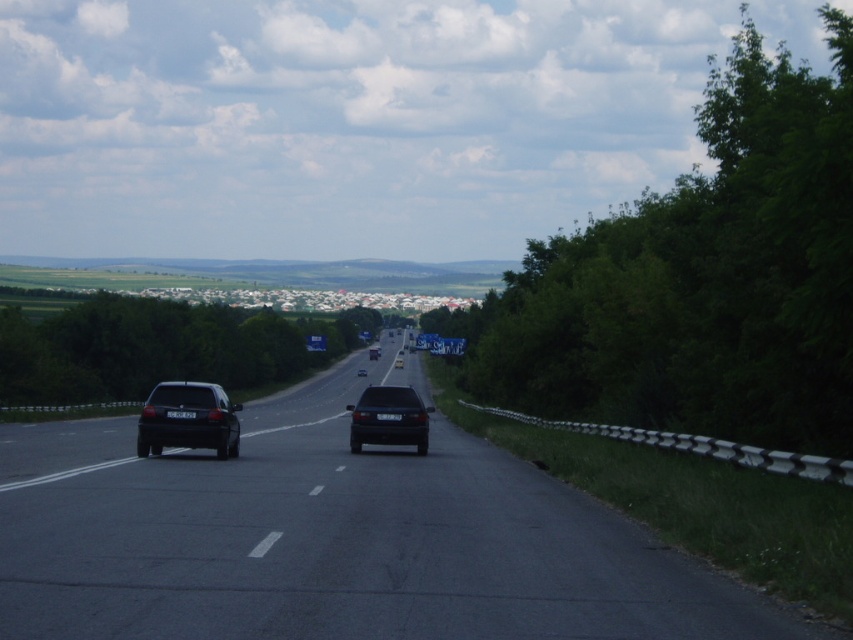
From the picture: You are a photographer planning to capture both the satin black sedan at left and the satin black sedan at center in your shot. Given that your camera frame can only accommodate objects up to 2 meters in width, which sedan should you focus on to ensure it fits within the frame?

The satin black sedan at left is thinner than the satin black sedan at center, so focusing on the satin black sedan at left would ensure it fits within the 2 meter width constraint of the camera frame.

You are a pedestrian standing at the edge of the black asphalt highway at center. You see the satin black sedan at left. Which direction should you look to see the sedan?

The satin black sedan at left is positioned further away from you than the black asphalt highway at center. Since the highway is at your feet, you should look towards the left side of the road and slightly ahead to spot the sedan.